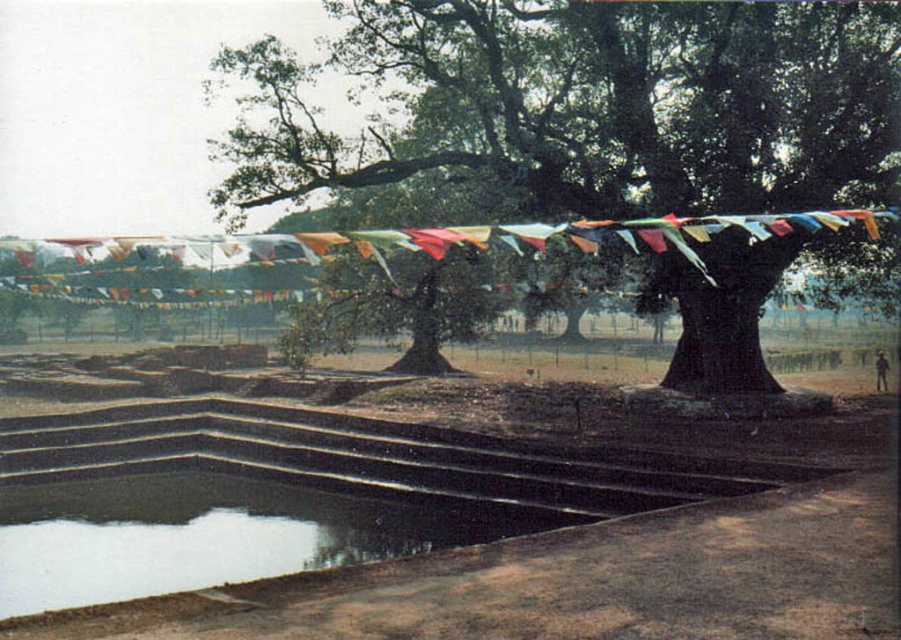
You are planning to set up a small tent in the brown earthy dirt field at center and the green leafy tree at center. Which location has enough space to accommodate the tent without being too close to the tree?

The brown earthy dirt field at center is wider than the green leafy tree at center, so the dirt field has enough space to place the tent away from the tree.

You are standing in the outdoor scene and want to walk from the brown earthy dirt field at center to the green leafy tree at center. Which direction should you move to reach the tree?

The brown earthy dirt field at center is positioned on the right side of green leafy tree at center, so you should move to the left to reach the tree.

You are planning to plant a small garden in the brown earthy dirt field at center and the clear water at bottom left. Which location would be more suitable for planting seeds?

The brown earthy dirt field at center is more suitable for planting seeds because it has a larger size compared to the clear water at bottom left, providing more space and appropriate soil for growth.